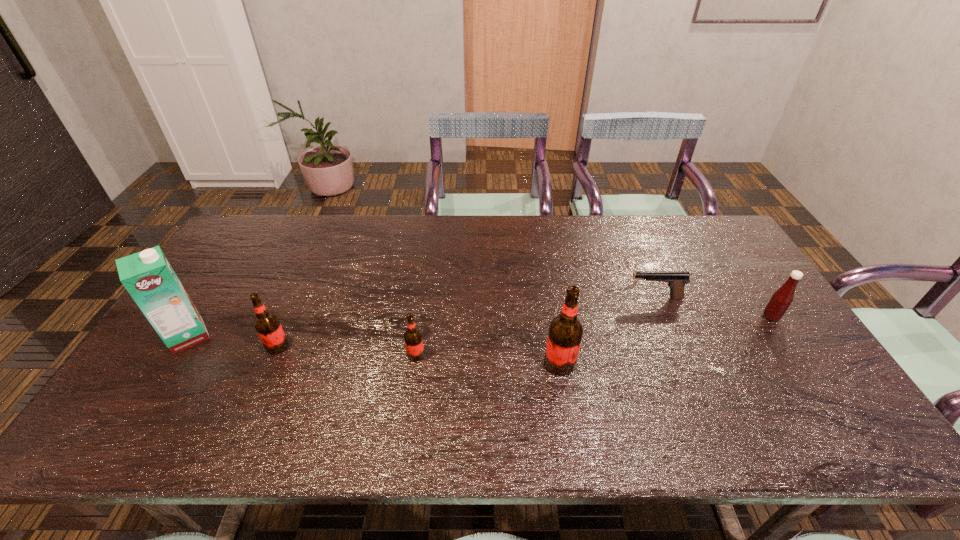
I want to click on vacant area between the carton and the shortest object, so click(x=421, y=317).

What are the coordinates of `empty space between the carton and the shortest root beer` in the screenshot? It's located at (301, 345).

You are a GUI agent. You are given a task and a screenshot of the screen. Output one action in this format:
    pyautogui.click(x=<x>, y=<y>)
    Task: Click on the free space between the shortest root beer and the third object from right to left
    
    Given the screenshot: What is the action you would take?
    pyautogui.click(x=488, y=359)

Where is `unoccupied position between the rightmost root beer and the fourth object from right to left`? The image size is (960, 540). unoccupied position between the rightmost root beer and the fourth object from right to left is located at coordinates point(488,359).

Find the location of a particular element. The width and height of the screenshot is (960, 540). free space between the rightmost object and the fourth object from right to left is located at coordinates (593, 336).

Locate an element on the screen. The image size is (960, 540). blank region between the rightmost object and the leftmost root beer is located at coordinates (524, 332).

Point out which object is positioned as the fifth nearest to the carton. Please provide its 2D coordinates. Your answer should be formatted as a tuple, i.e. [(x, y)], where the tuple contains the x and y coordinates of a point satisfying the conditions above.

[(780, 301)]

Where is `object that is the fifth closest to the carton`? This screenshot has width=960, height=540. object that is the fifth closest to the carton is located at coordinates (780, 301).

Select which root beer appears as the closest to the rightmost root beer. Please provide its 2D coordinates. Your answer should be formatted as a tuple, i.e. [(x, y)], where the tuple contains the x and y coordinates of a point satisfying the conditions above.

[(413, 339)]

Locate which root beer is the closest to the second tallest root beer. Please provide its 2D coordinates. Your answer should be formatted as a tuple, i.e. [(x, y)], where the tuple contains the x and y coordinates of a point satisfying the conditions above.

[(413, 339)]